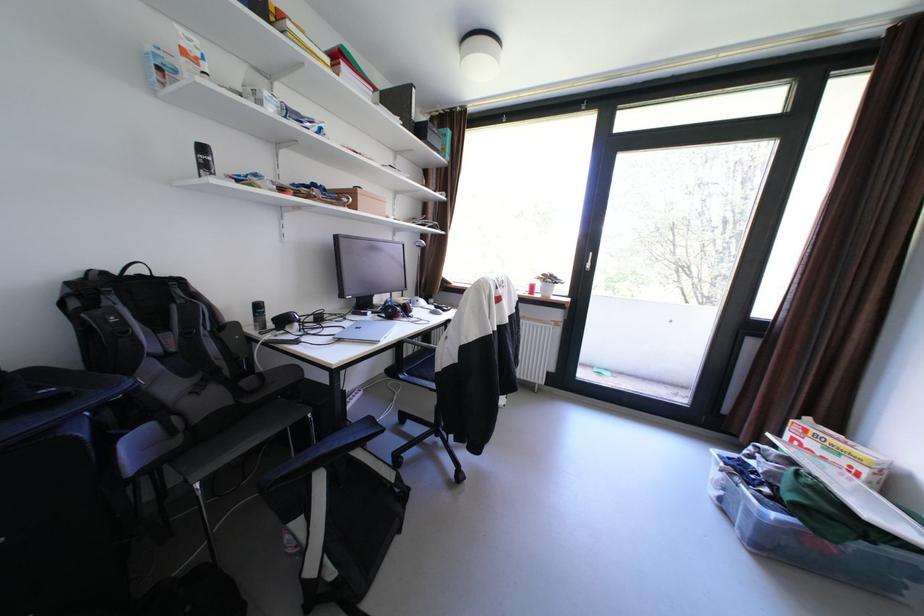
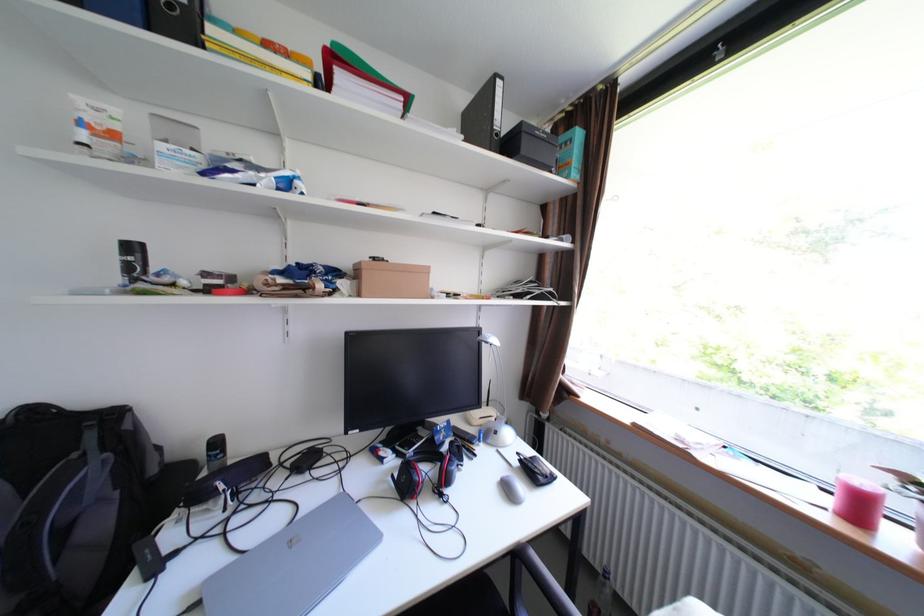
Where in the second image is the point corresponding to pixel 543 283 from the first image?

(874, 484)